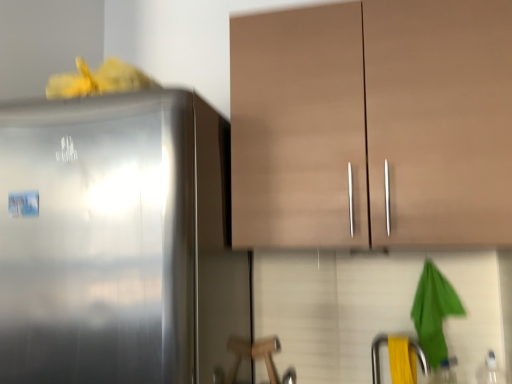
Question: From a real-world perspective, is matte brown cabinet at upper center over yellow rubber at lower right?

Choices:
 (A) yes
 (B) no

Answer: (A)

Question: Considering the relative sizes of matte brown cabinet at upper center and yellow rubber at lower right in the image provided, is matte brown cabinet at upper center bigger than yellow rubber at lower right?

Choices:
 (A) no
 (B) yes

Answer: (B)

Question: Is matte brown cabinet at upper center in front of yellow rubber at lower right?

Choices:
 (A) yes
 (B) no

Answer: (A)

Question: Does matte brown cabinet at upper center have a lesser height compared to yellow rubber at lower right?

Choices:
 (A) yes
 (B) no

Answer: (B)

Question: From the image's perspective, is matte brown cabinet at upper center beneath yellow rubber at lower right?

Choices:
 (A) yes
 (B) no

Answer: (B)

Question: In terms of width, does satin silver refrigerator at left look wider or thinner when compared to matte brown cabinet at upper center?

Choices:
 (A) wide
 (B) thin

Answer: (A)

Question: Relative to matte brown cabinet at upper center, is satin silver refrigerator at left in front or behind?

Choices:
 (A) front
 (B) behind

Answer: (A)

Question: In terms of height, does satin silver refrigerator at left look taller or shorter compared to matte brown cabinet at upper center?

Choices:
 (A) tall
 (B) short

Answer: (A)

Question: In terms of size, does satin silver refrigerator at left appear bigger or smaller than matte brown cabinet at upper center?

Choices:
 (A) big
 (B) small

Answer: (A)

Question: Considering the positions of yellow rubber at lower right and satin silver refrigerator at left in the image, is yellow rubber at lower right taller or shorter than satin silver refrigerator at left?

Choices:
 (A) short
 (B) tall

Answer: (A)

Question: From a real-world perspective, is yellow rubber at lower right positioned above or below satin silver refrigerator at left?

Choices:
 (A) above
 (B) below

Answer: (B)

Question: Based on their sizes in the image, would you say yellow rubber at lower right is bigger or smaller than satin silver refrigerator at left?

Choices:
 (A) small
 (B) big

Answer: (A)

Question: Considering the positions of yellow rubber at lower right and satin silver refrigerator at left in the image, is yellow rubber at lower right wider or thinner than satin silver refrigerator at left?

Choices:
 (A) wide
 (B) thin

Answer: (B)

Question: Considering the positions of yellow rubber at lower right and matte brown cabinet at upper center in the image, is yellow rubber at lower right wider or thinner than matte brown cabinet at upper center?

Choices:
 (A) thin
 (B) wide

Answer: (A)

Question: Choose the correct answer: Is yellow rubber at lower right inside matte brown cabinet at upper center or outside it?

Choices:
 (A) outside
 (B) inside

Answer: (A)